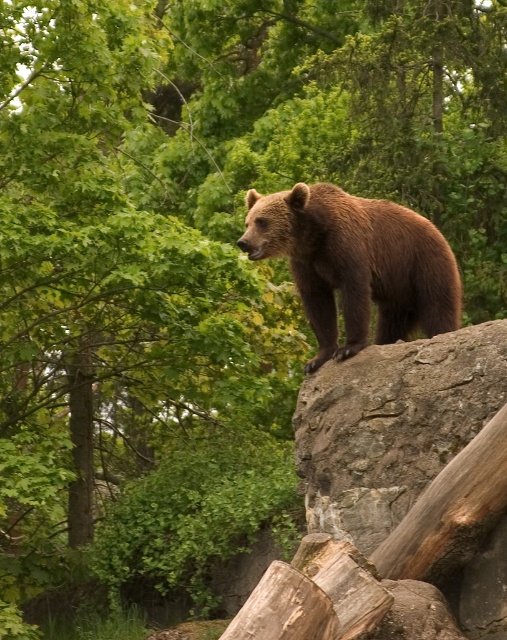
Question: Considering the relative positions of rough textured rock at upper center and brown furry bear at center in the image provided, where is rough textured rock at upper center located with respect to brown furry bear at center?

Choices:
 (A) right
 (B) left

Answer: (A)

Question: Which point is farther to the camera?

Choices:
 (A) (305, 452)
 (B) (357, 342)

Answer: (A)

Question: Does rough textured rock at upper center have a greater width compared to brown furry bear at center?

Choices:
 (A) yes
 (B) no

Answer: (B)

Question: Which point is farther from the camera taking this photo?

Choices:
 (A) (329, 205)
 (B) (458, 412)

Answer: (A)

Question: Is rough textured rock at upper center to the left of brown furry bear at center from the viewer's perspective?

Choices:
 (A) yes
 (B) no

Answer: (B)